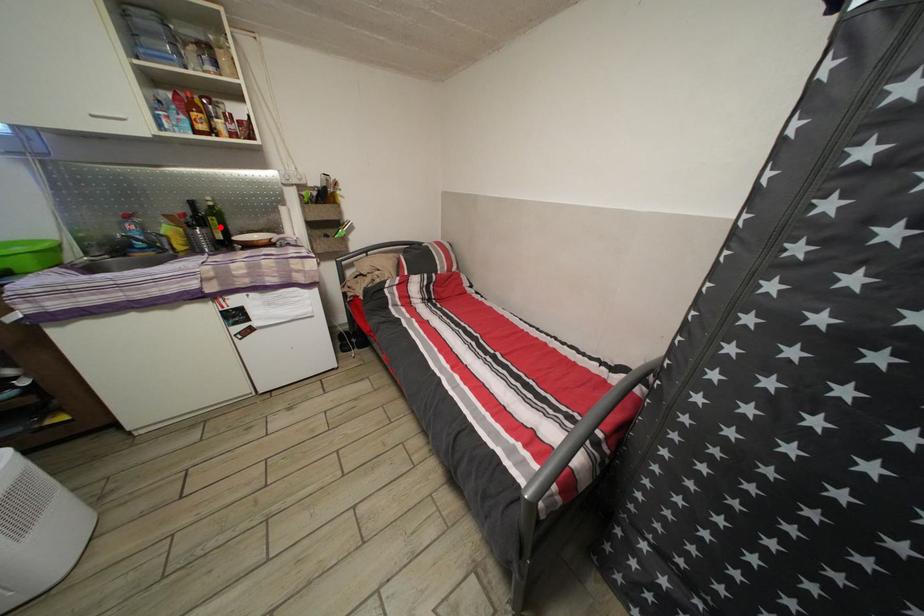
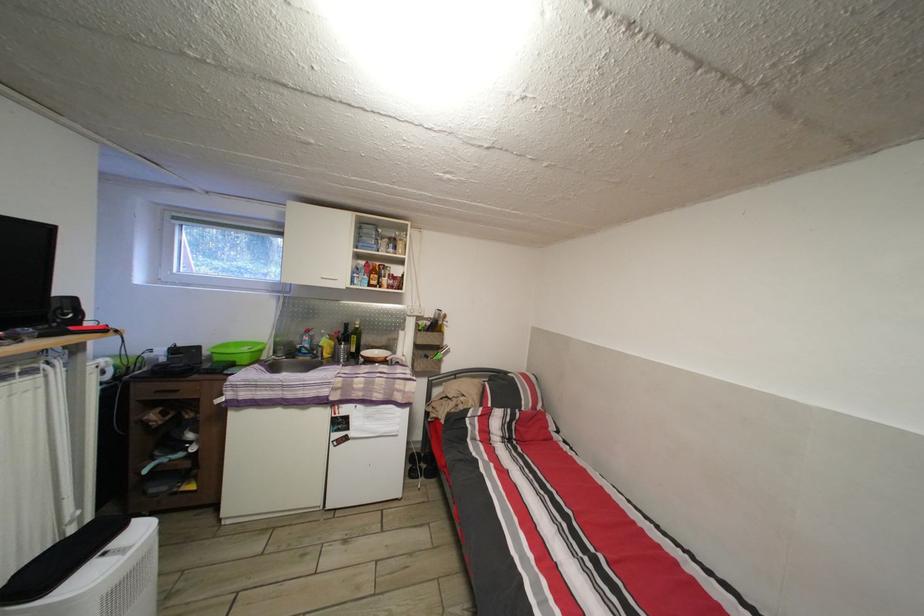
Where in the second image is the point corresponding to the highlighted location from the first image?

(360, 345)